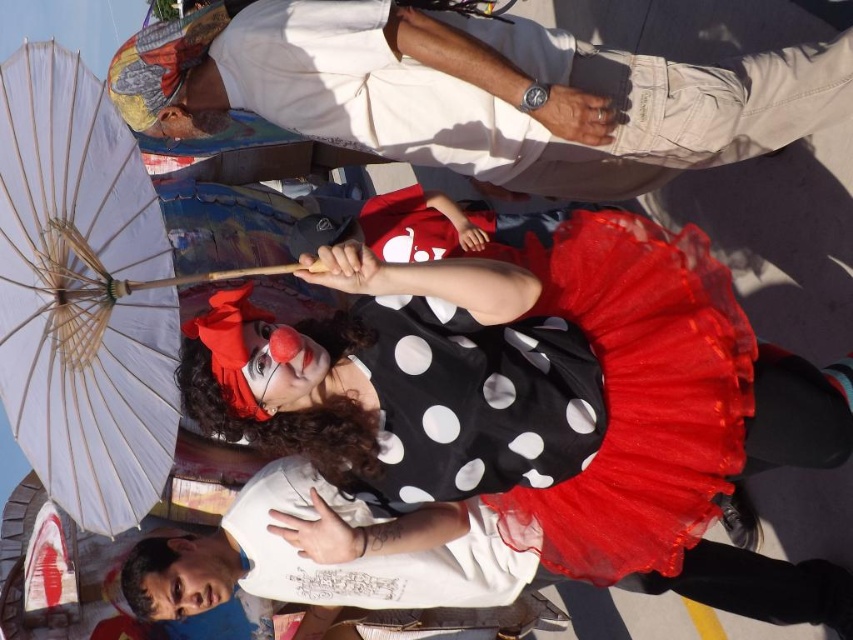
Locate an element on the screen. white paper umbrella at left is located at coordinates (82, 294).

Is point (141, 349) positioned behind point (656, 346)?

No, (141, 349) is in front of (656, 346).

Which is behind, point (103, 205) or point (631, 522)?

The point (631, 522) is more distant.

Locate an element on the screen. Image resolution: width=853 pixels, height=640 pixels. white paper umbrella at left is located at coordinates (82, 294).

Is white cotton shirt at upper center positioned behind white paper umbrella at left?

Yes, it is behind white paper umbrella at left.

Image resolution: width=853 pixels, height=640 pixels. What are the coordinates of `white cotton shirt at upper center` in the screenshot? It's located at (474, 93).

Is white cotton shirt at upper center above black polka dot tulle dress at center?

Yes.

Consider the image. Which is more to the right, white cotton shirt at upper center or black polka dot tulle dress at center?

black polka dot tulle dress at center

Measure the distance between white cotton shirt at upper center and camera.

white cotton shirt at upper center and camera are 10.98 feet apart.

What are the coordinates of `white cotton shirt at upper center` in the screenshot? It's located at (474, 93).